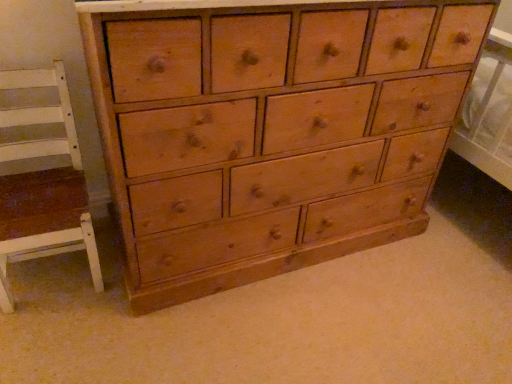
Describe the element at coordinates (42, 184) in the screenshot. This screenshot has width=512, height=384. I see `white painted wood chair at left` at that location.

Image resolution: width=512 pixels, height=384 pixels. What are the coordinates of `white painted wood chair at left` in the screenshot? It's located at (42, 184).

Find the location of a particular element. Image resolution: width=512 pixels, height=384 pixels. white painted wood chair at left is located at coordinates (42, 184).